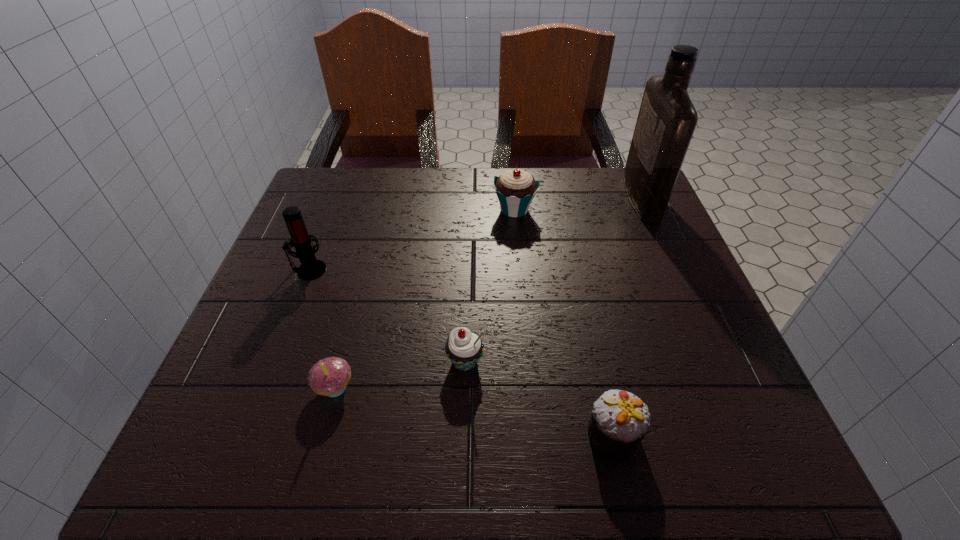
Identify the location of free region located 0.300m on the label side of the rightmost object. This screenshot has height=540, width=960. (513, 198).

Identify the location of free region located on the label side of the rightmost object. (601, 198).

Find the location of a particular element. The width and height of the screenshot is (960, 540). free space located on the label side of the rightmost object is located at coordinates (520, 198).

Locate an element on the screen. Image resolution: width=960 pixels, height=540 pixels. free space located 0.160m on the right of the fourth nearest object is located at coordinates (399, 270).

Image resolution: width=960 pixels, height=540 pixels. I want to click on blank space located 0.360m on the front of the second cupcake from right to left, so click(527, 344).

The width and height of the screenshot is (960, 540). In order to click on vacant space located on the right of the second cupcake from left to right in this screenshot , I will do `click(623, 361)`.

Find the location of `vacant region located 0.350m on the back of the fifth object from right to left`. vacant region located 0.350m on the back of the fifth object from right to left is located at coordinates (373, 242).

Where is `free location located 0.160m on the right of the nearest cupcake`? This screenshot has width=960, height=540. free location located 0.160m on the right of the nearest cupcake is located at coordinates (740, 434).

I want to click on liquor situated at the far edge, so click(667, 118).

Image resolution: width=960 pixels, height=540 pixels. Find the location of `cupcake that is positioned at the far edge`. cupcake that is positioned at the far edge is located at coordinates (515, 189).